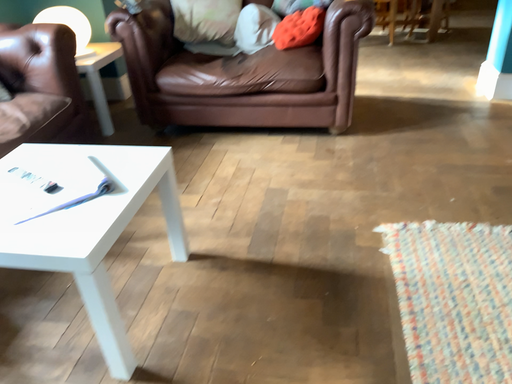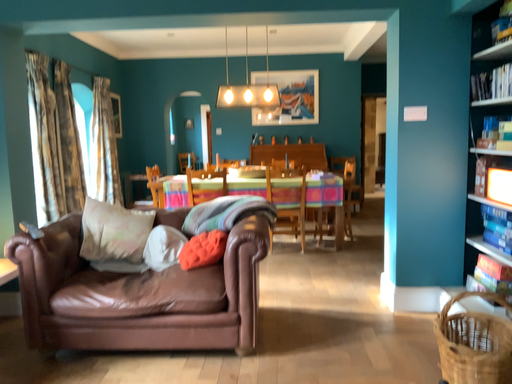
Question: How did the camera likely rotate when shooting the video?

Choices:
 (A) rotated left
 (B) rotated right

Answer: (B)